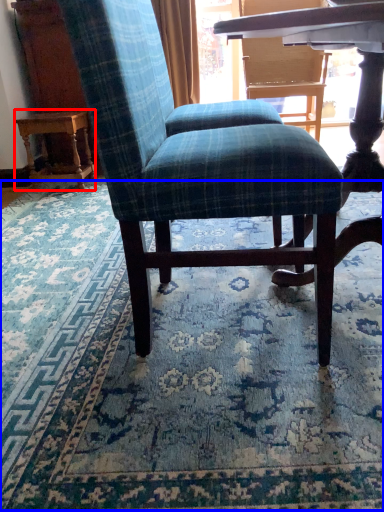
Question: Which point is further to the camera, table (highlighted by a red box) or mat (highlighted by a blue box)?

Choices:
 (A) table
 (B) mat

Answer: (A)